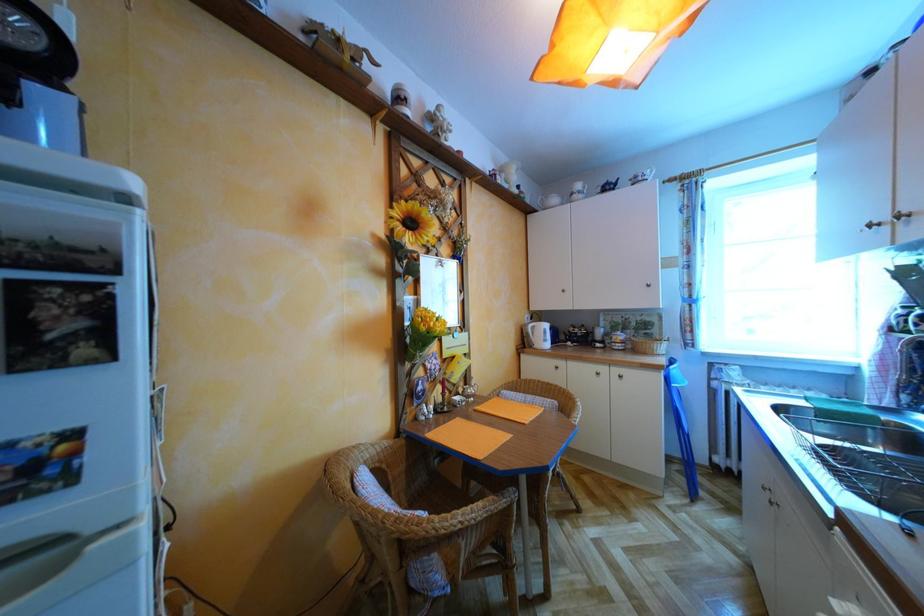
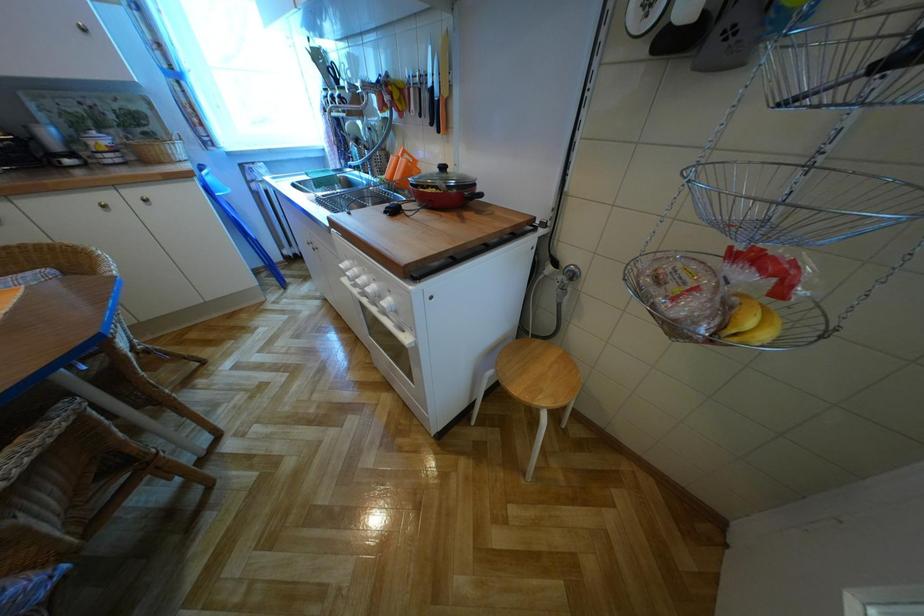
First-person continuous shooting, in which direction is the camera rotating?

The camera rotated toward right-down.